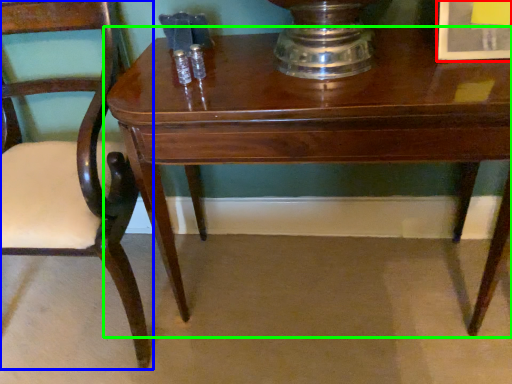
Question: Which object is positioned closest to picture frame (highlighted by a red box)? Select from chair (highlighted by a blue box) and table (highlighted by a green box).

Choices:
 (A) chair
 (B) table

Answer: (B)